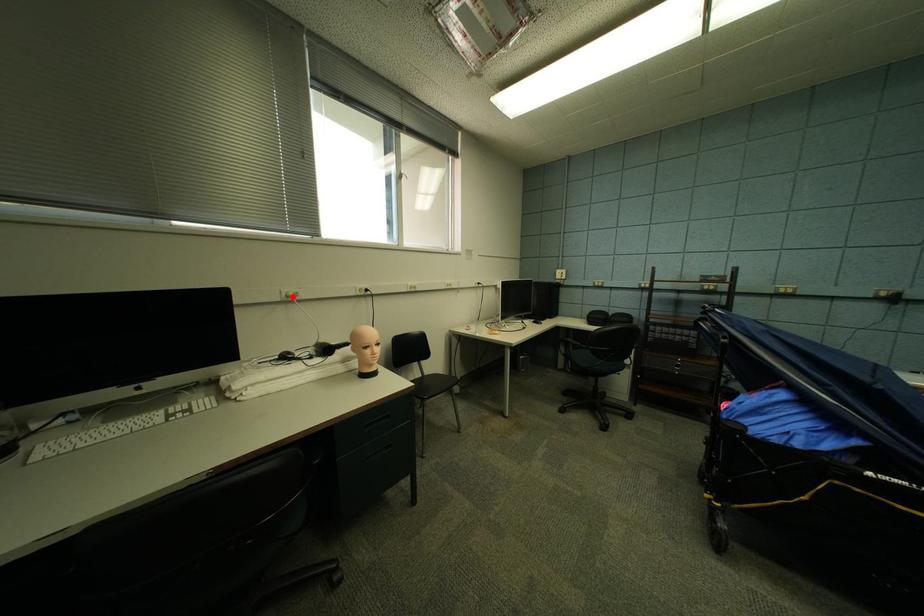
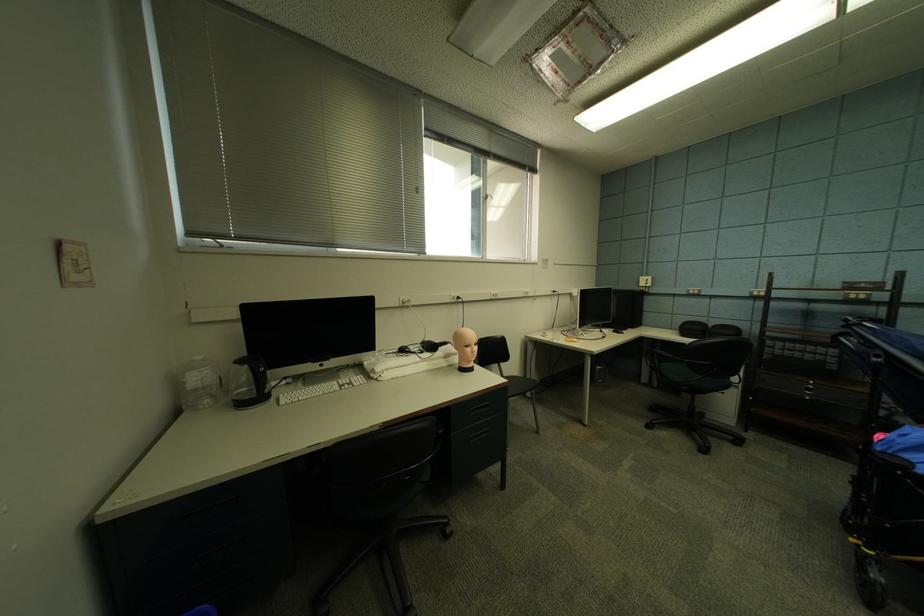
Where in the second image is the point corresponding to the highlighted location from the first image?

(409, 302)